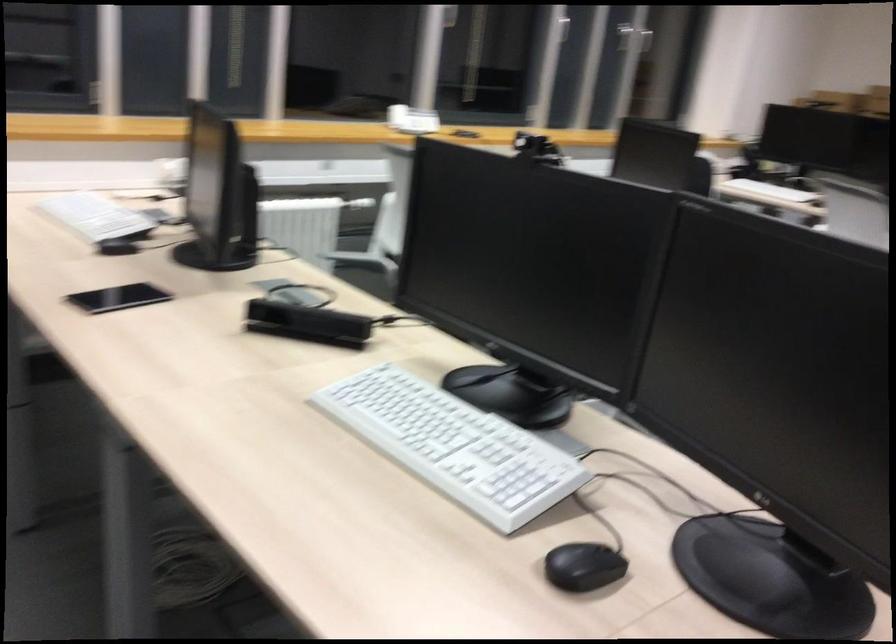
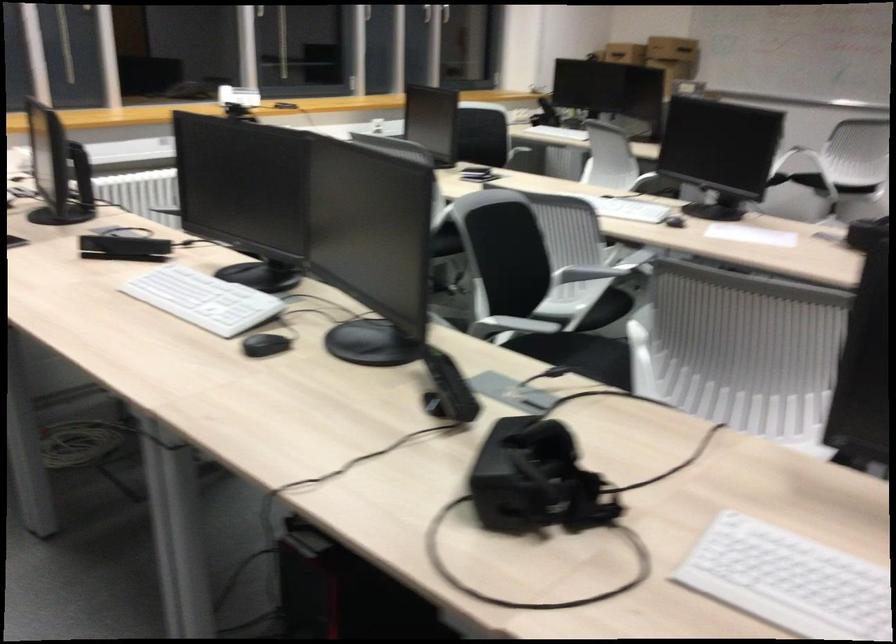
Where in the second image is the point corresponding to the point at 582,564 from the first image?

(264, 345)